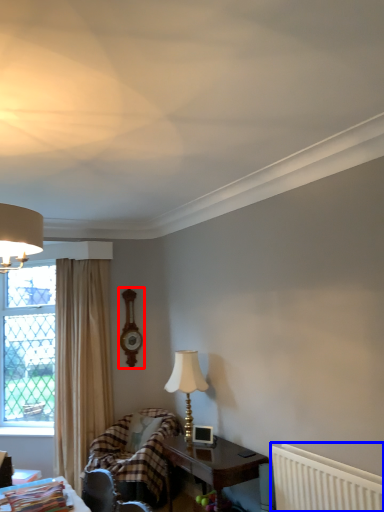
Question: Among these objects, which one is nearest to the camera, clock (highlighted by a red box) or radiator (highlighted by a blue box)?

Choices:
 (A) clock
 (B) radiator

Answer: (B)